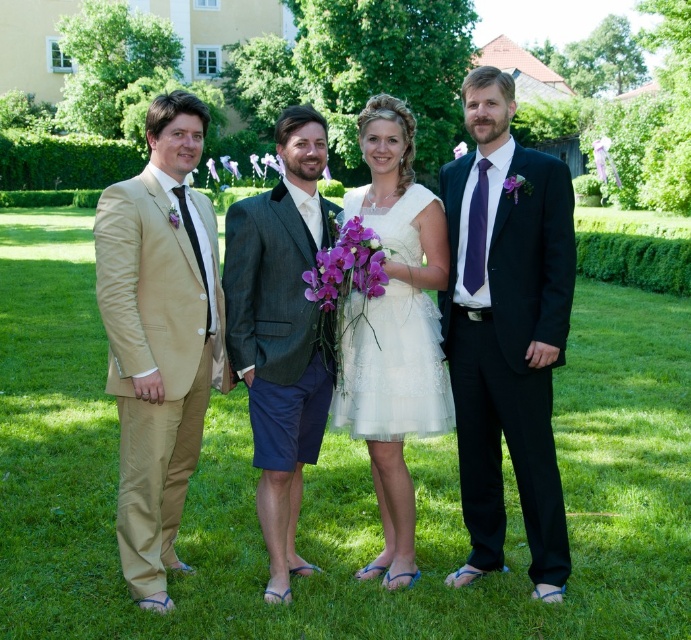
Can you confirm if green grass at center is positioned to the right of purple fabric flower at right?

No, green grass at center is not to the right of purple fabric flower at right.

Who is more forward, (100, 476) or (511, 176)?

Point (511, 176) is more forward.

Which is behind, point (59, 602) or point (504, 193)?

Point (504, 193)

In order to click on green grass at center in this screenshot , I will do `click(332, 484)`.

Does tan satin suit at left appear under purple silk flower at center?

Correct, tan satin suit at left is located below purple silk flower at center.

Can you confirm if tan satin suit at left is positioned to the left of purple silk flower at center?

Correct, you'll find tan satin suit at left to the left of purple silk flower at center.

Between point (169, 481) and point (359, 248), which one is positioned in front?

Point (359, 248) is in front.

You are a GUI agent. You are given a task and a screenshot of the screen. Output one action in this format:
    pyautogui.click(x=<x>, y=<y>)
    Task: Click on the tan satin suit at left
    
    Given the screenshot: What is the action you would take?
    pyautogui.click(x=160, y=337)

Does white lace dress at center appear on the right side of purple silk flower at center?

Correct, you'll find white lace dress at center to the right of purple silk flower at center.

Does white lace dress at center have a lesser height compared to purple silk flower at center?

No, white lace dress at center is not shorter than purple silk flower at center.

Which is behind, point (408, 413) or point (334, 234)?

Point (334, 234)

Identify the location of white lace dress at center. (390, 368).